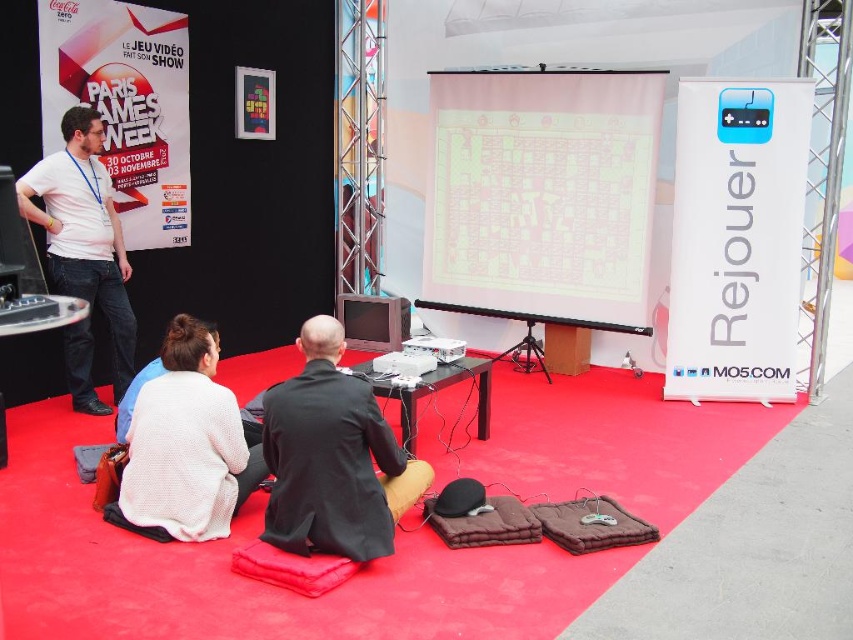
Question: From the image, what is the correct spatial relationship of white matte projection screen at center in relation to black fabric at center?

Choices:
 (A) above
 (B) below

Answer: (A)

Question: Can you confirm if black fabric at center is bigger than white matte shirt at left?

Choices:
 (A) yes
 (B) no

Answer: (B)

Question: Does white knitted sweater at lower left appear under white matte shirt at left?

Choices:
 (A) no
 (B) yes

Answer: (B)

Question: Which is nearer to the white matte shirt at left?

Choices:
 (A) white plastic projector at center
 (B) white knitted sweater at lower left

Answer: (B)

Question: Which point appears farthest from the camera in this image?

Choices:
 (A) (175, 380)
 (B) (418, 342)
 (C) (83, 234)

Answer: (C)

Question: Which object is the closest to the white plastic projector at center?

Choices:
 (A) white knitted sweater at lower left
 (B) white matte projection screen at center
 (C) black fabric at center

Answer: (C)